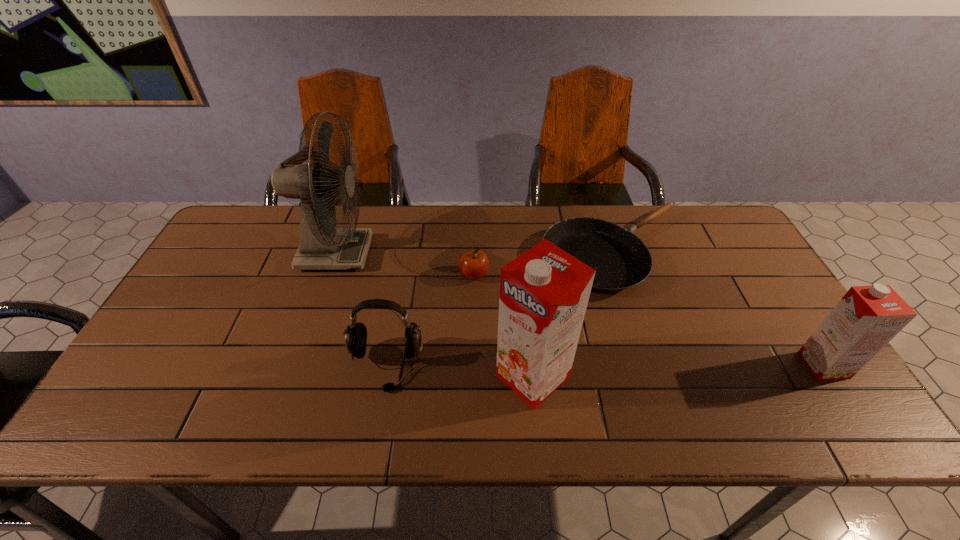
Locate an element on the screen. Image resolution: width=960 pixels, height=540 pixels. free space for a new carton on the left is located at coordinates (229, 387).